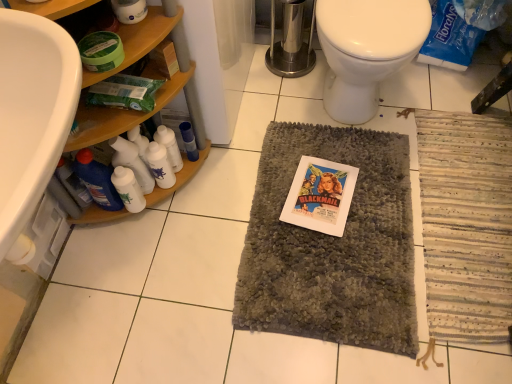
Where is `vacant space positioned to the left of striped fabric bath mat at lower right`? The image size is (512, 384). vacant space positioned to the left of striped fabric bath mat at lower right is located at coordinates (321, 236).